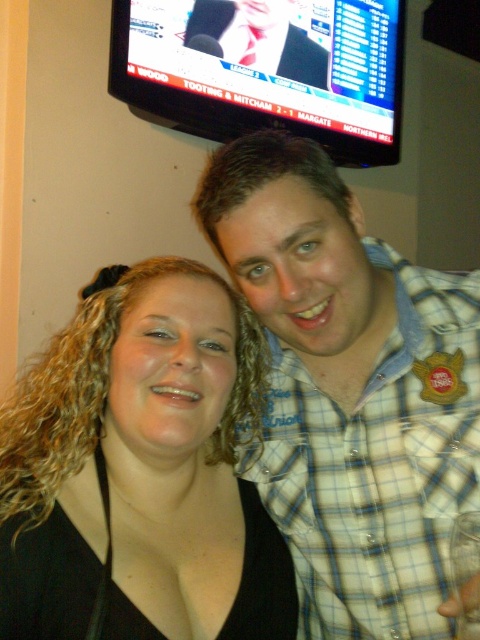
Question: Can you confirm if black matte hair at center is bigger than matte black tie at upper center?

Choices:
 (A) no
 (B) yes

Answer: (B)

Question: Does black matte hair at center appear over matte black tie at upper center?

Choices:
 (A) no
 (B) yes

Answer: (A)

Question: Which object is the closest to the black matte hair at center?

Choices:
 (A) blue plaid shirt at center
 (B) matte black tie at upper center

Answer: (A)

Question: Which point is closer to the camera?

Choices:
 (A) matte black tie at upper center
 (B) blue plaid shirt at center
 (C) black matte hair at center

Answer: (C)

Question: Does black matte hair at center appear on the left side of matte black tie at upper center?

Choices:
 (A) no
 (B) yes

Answer: (B)

Question: Among these points, which one is farthest from the camera?

Choices:
 (A) (52, 602)
 (B) (252, 28)

Answer: (B)